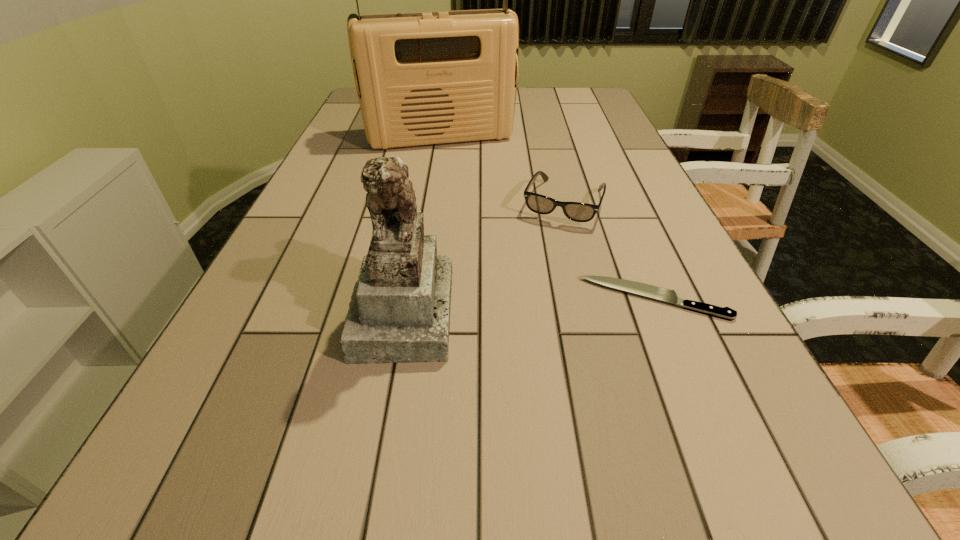
The width and height of the screenshot is (960, 540). Identify the location of free point at the far right corner. (588, 103).

Image resolution: width=960 pixels, height=540 pixels. In order to click on free space at the near right corner in this screenshot , I will do `click(705, 416)`.

This screenshot has height=540, width=960. Find the location of `vacant area that lies between the tallest object and the shortest object`. vacant area that lies between the tallest object and the shortest object is located at coordinates click(547, 218).

Locate an element on the screen. The height and width of the screenshot is (540, 960). vacant area that lies between the spectacles and the radio receiver is located at coordinates (502, 171).

Locate an element on the screen. free spot between the third nearest object and the shortest object is located at coordinates (609, 251).

Image resolution: width=960 pixels, height=540 pixels. Find the location of `unoccupied position between the second farthest object and the shortest object`. unoccupied position between the second farthest object and the shortest object is located at coordinates (609, 251).

Locate an element on the screen. free area in between the spectacles and the tallest object is located at coordinates (502, 171).

This screenshot has height=540, width=960. I want to click on free space between the steak knife and the spectacles, so click(609, 251).

Locate an element on the screen. This screenshot has width=960, height=540. empty space between the steak knife and the tallest object is located at coordinates (547, 218).

Select which object is the second closest to the radio receiver. Please provide its 2D coordinates. Your answer should be formatted as a tuple, i.e. [(x, y)], where the tuple contains the x and y coordinates of a point satisfying the conditions above.

[(400, 312)]